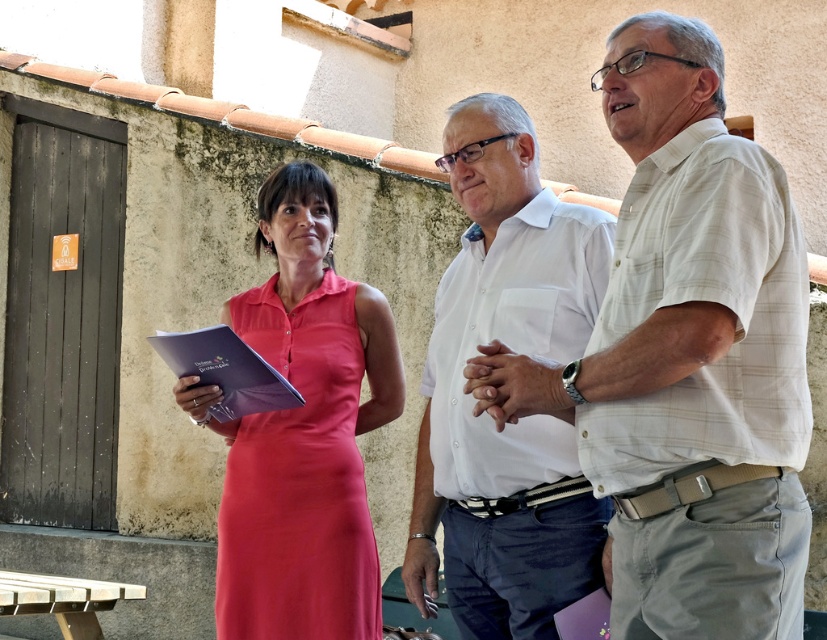
Question: Among these points, which one is nearest to the camera?

Choices:
 (A) (460, 492)
 (B) (749, 296)

Answer: (B)

Question: Which of the following is the closest to the observer?

Choices:
 (A) (672, 65)
 (B) (532, 572)

Answer: (A)

Question: Is white plaid shirt at center to the left of white cotton shirt at center from the viewer's perspective?

Choices:
 (A) no
 (B) yes

Answer: (A)

Question: Which object appears farthest from the camera in this image?

Choices:
 (A) white plaid shirt at center
 (B) white cotton shirt at center
 (C) satin pink dress at center

Answer: (C)

Question: Is white plaid shirt at center behind white cotton shirt at center?

Choices:
 (A) yes
 (B) no

Answer: (B)

Question: Does white cotton shirt at center have a larger size compared to satin pink dress at center?

Choices:
 (A) yes
 (B) no

Answer: (A)